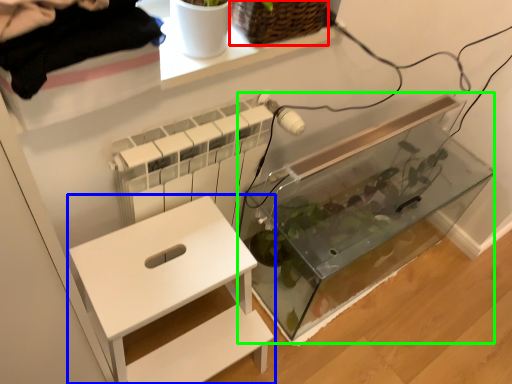
Question: Estimate the real-world distances between objects in this image. Which object is farther from basket (highlighted by a red box), furniture (highlighted by a blue box) or glass box (highlighted by a green box)?

Choices:
 (A) furniture
 (B) glass box

Answer: (B)